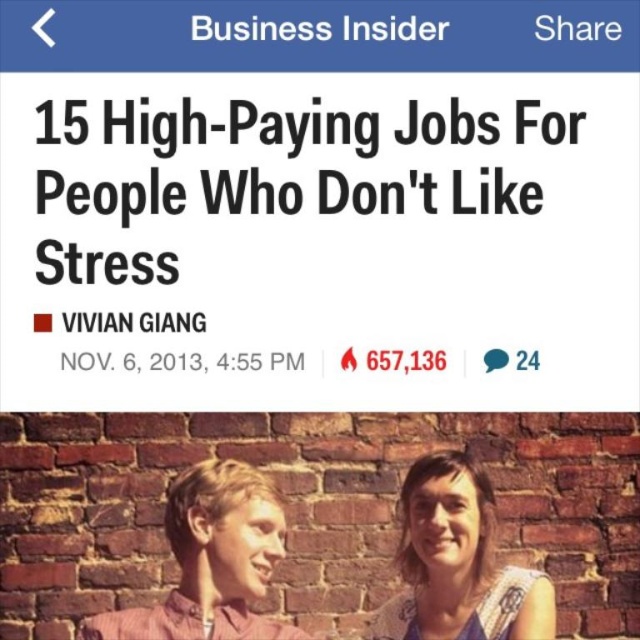
Question: Among these points, which one is nearest to the camera?

Choices:
 (A) (180, 524)
 (B) (400, 500)

Answer: (A)

Question: Which point is farther to the camera?

Choices:
 (A) blue lace dress at center
 (B) matte pink shirt at center

Answer: (A)

Question: Is black text at upper center thinner than blue lace dress at center?

Choices:
 (A) yes
 (B) no

Answer: (B)

Question: Which point is closer to the camera?

Choices:
 (A) black text at upper center
 (B) blue lace dress at center

Answer: (B)

Question: Can you confirm if blue lace dress at center is positioned below matte pink shirt at center?

Choices:
 (A) no
 (B) yes

Answer: (B)

Question: Can you confirm if black text at upper center is positioned to the left of blue lace dress at center?

Choices:
 (A) yes
 (B) no

Answer: (A)